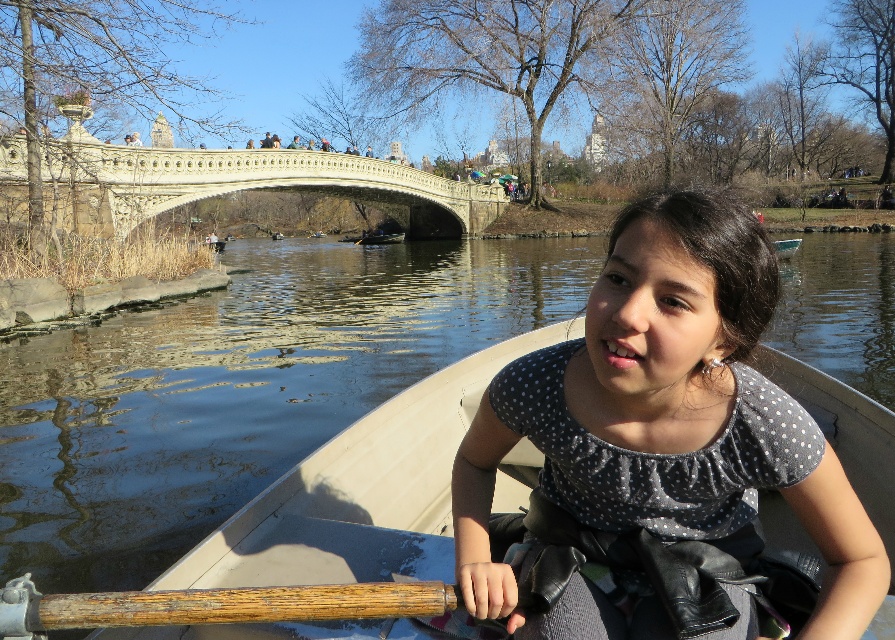
Which is behind, point (74, 337) or point (49, 616)?

The point (74, 337) is more distant.

Who is shorter, clear water at boat center or wooden textured paddle at lower left?

Standing shorter between the two is wooden textured paddle at lower left.

Is point (50, 563) closer to viewer compared to point (390, 582)?

That is False.

The image size is (895, 640). What are the coordinates of `clear water at boat center` in the screenshot? It's located at (239, 388).

At what (x,y) coordinates should I click in order to perform the action: click on polka dot fabric shirt at center. Please return your answer as a coordinate pair (x, y). The width and height of the screenshot is (895, 640). Looking at the image, I should click on (663, 420).

The width and height of the screenshot is (895, 640). What are the coordinates of `polka dot fabric shirt at center` in the screenshot? It's located at (663, 420).

Who is positioned more to the right, clear water at boat center or polka dot fabric shirt at center?

From the viewer's perspective, polka dot fabric shirt at center appears more on the right side.

Consider the image. Can you confirm if clear water at boat center is positioned to the left of polka dot fabric shirt at center?

Yes, clear water at boat center is to the left of polka dot fabric shirt at center.

Is point (176, 556) farther from viewer compared to point (624, 314)?

Yes.

This screenshot has height=640, width=895. Identify the location of clear water at boat center. (239, 388).